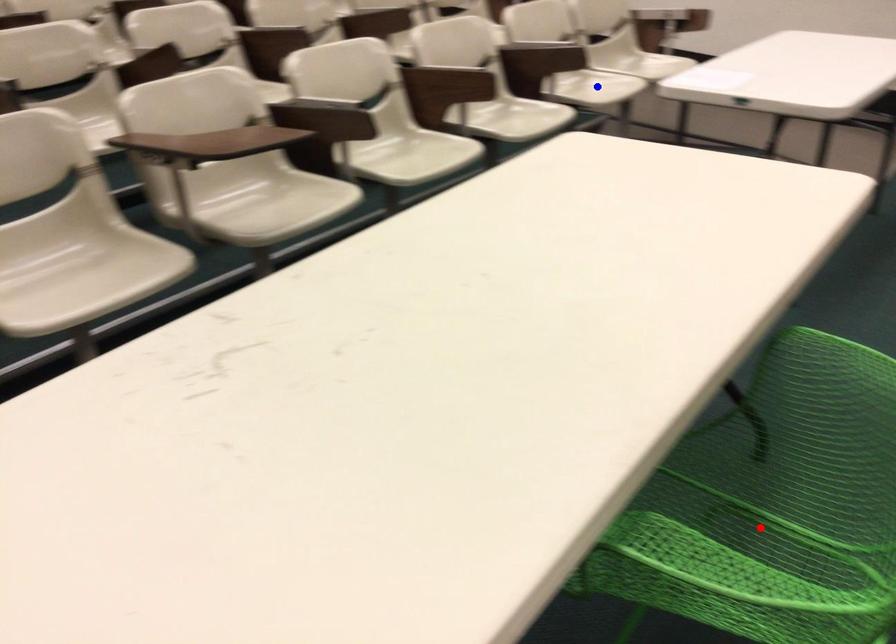
Question: Two points are marked on the image. Which point is closer to the camera?

Choices:
 (A) Blue point is closer.
 (B) Red point is closer.

Answer: (B)